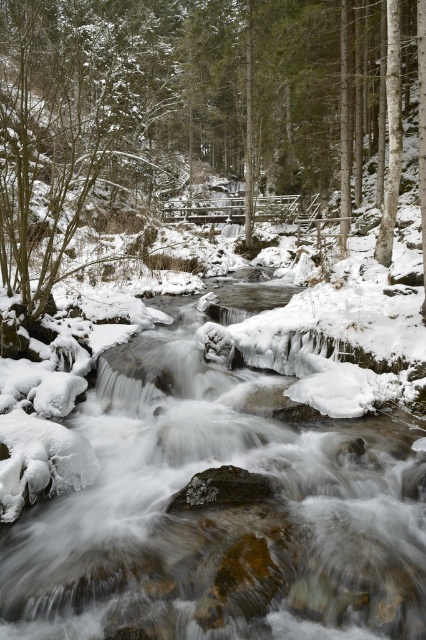
Question: Which of the following is the closest to the observer?

Choices:
 (A) (95, 150)
 (B) (62, 150)

Answer: (A)

Question: Which of the following is the farthest from the observer?

Choices:
 (A) icy smooth water at center
 (B) snowy evergreen tree at center

Answer: (B)

Question: Which point is closer to the camera taking this photo?

Choices:
 (A) (117, 168)
 (B) (94, 172)
 (C) (11, 385)

Answer: (C)

Question: Does icy smooth water at center lie in front of snowy bark tree at center?

Choices:
 (A) no
 (B) yes

Answer: (B)

Question: Is icy smooth water at center wider than snowy bark tree at center?

Choices:
 (A) no
 (B) yes

Answer: (A)

Question: Is icy smooth water at center to the right of snowy evergreen tree at center from the viewer's perspective?

Choices:
 (A) no
 (B) yes

Answer: (B)